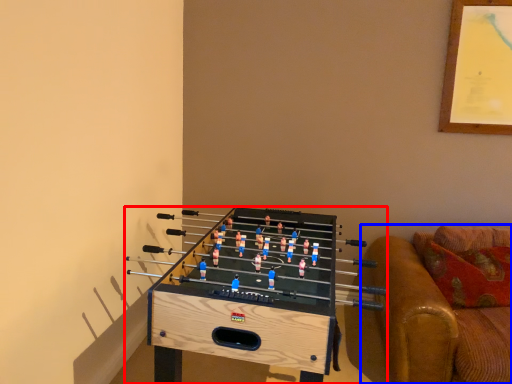
Question: Which point is closer to the camera, furniture (highlighted by a red box) or studio couch (highlighted by a blue box)?

Choices:
 (A) furniture
 (B) studio couch

Answer: (A)